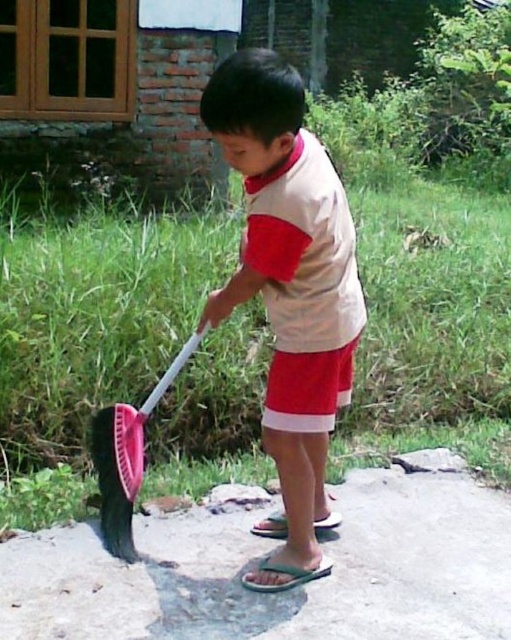
You are a parent supervising a child who is playing with a pink plastic shovel at lower left and a smooth concrete pavement at lower center. The child wants to dig a hole using the shovel. Which object should they use to dig the hole?

The child should use the pink plastic shovel at lower left to dig the hole because the smooth concrete pavement at lower center is harder and less suitable for digging.

You are a parent supervising a child who is trying to sweep the smooth concrete pavement at lower center. The child accidentally steps on the pink plastic shovel at lower left. Based on the scene description, where is the shovel located relative to the pavement?

The pink plastic shovel at lower left is above the smooth concrete pavement at lower center since the pavement is positioned under the shovel.